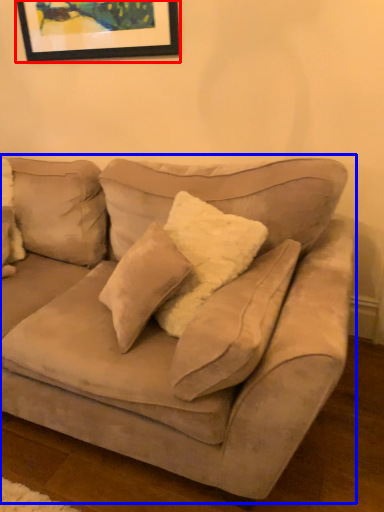
Question: Which point is further to the camera, picture frame (highlighted by a red box) or studio couch (highlighted by a blue box)?

Choices:
 (A) picture frame
 (B) studio couch

Answer: (A)